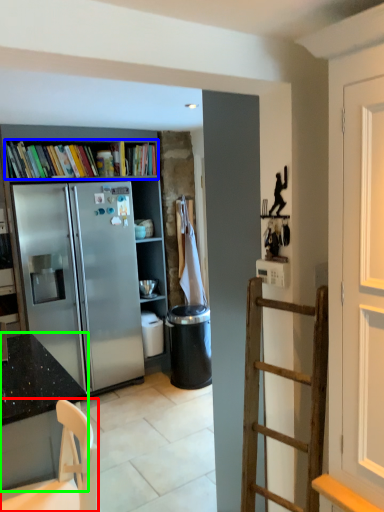
Question: Considering the real-world distances, which object is closest to chair (highlighted by a red box)? book (highlighted by a blue box) or cabinetry (highlighted by a green box).

Choices:
 (A) book
 (B) cabinetry

Answer: (B)